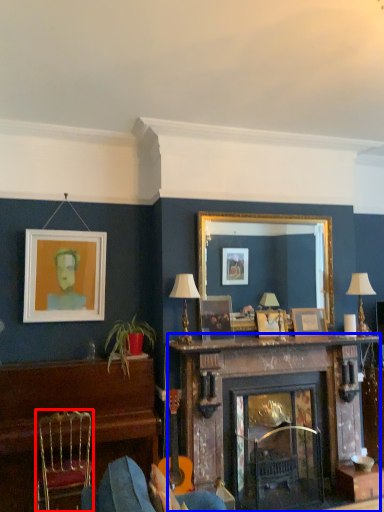
Question: Which point is closer to the camera, chair (highlighted by a red box) or fireplace (highlighted by a blue box)?

Choices:
 (A) chair
 (B) fireplace

Answer: (A)